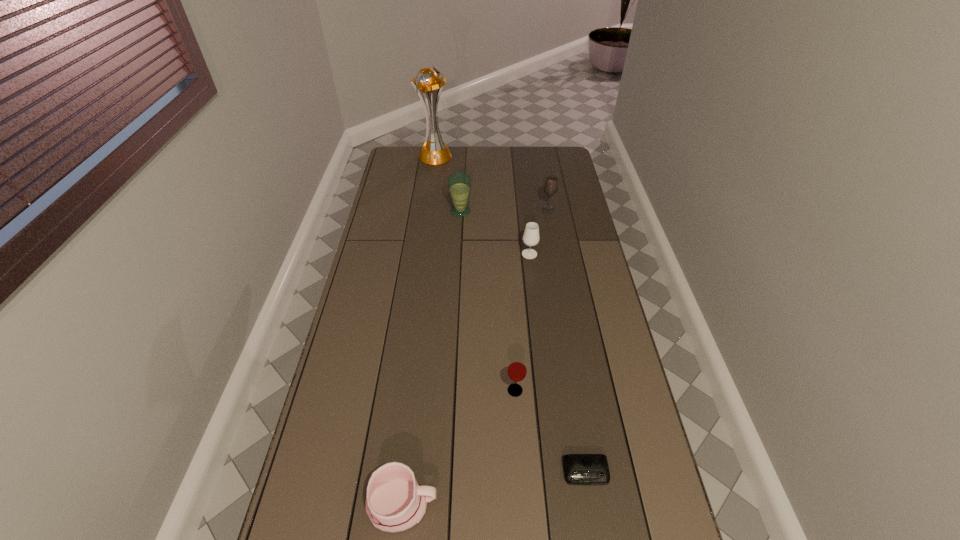
Locate an element on the screen. The height and width of the screenshot is (540, 960). alarm clock at the right edge is located at coordinates (579, 469).

Image resolution: width=960 pixels, height=540 pixels. Identify the location of object that is at the far left corner. (434, 152).

The image size is (960, 540). In order to click on vacant space at the far edge in this screenshot , I will do `click(531, 154)`.

The height and width of the screenshot is (540, 960). In the image, there is a desktop. Identify the location of vacant space at the left edge. (396, 272).

The height and width of the screenshot is (540, 960). I want to click on free space at the right edge, so click(x=649, y=467).

At what (x,y) coordinates should I click in order to perform the action: click on empty location between the alarm clock and the second shortest object. Please return your answer as a coordinate pair (x, y). The image size is (960, 540). Looking at the image, I should click on (494, 489).

The image size is (960, 540). In order to click on vacant area that lies between the trophy and the leftmost glass in this screenshot , I will do `click(447, 184)`.

Find the location of a particular element. This screenshot has height=540, width=960. free space that is in between the leftmost glass and the second nearest glass is located at coordinates (495, 233).

Find the location of a particular element. This screenshot has height=540, width=960. free space between the second shortest object and the farthest object is located at coordinates (419, 330).

The image size is (960, 540). In order to click on vacant area between the shortest object and the sixth tallest object in this screenshot , I will do `click(494, 489)`.